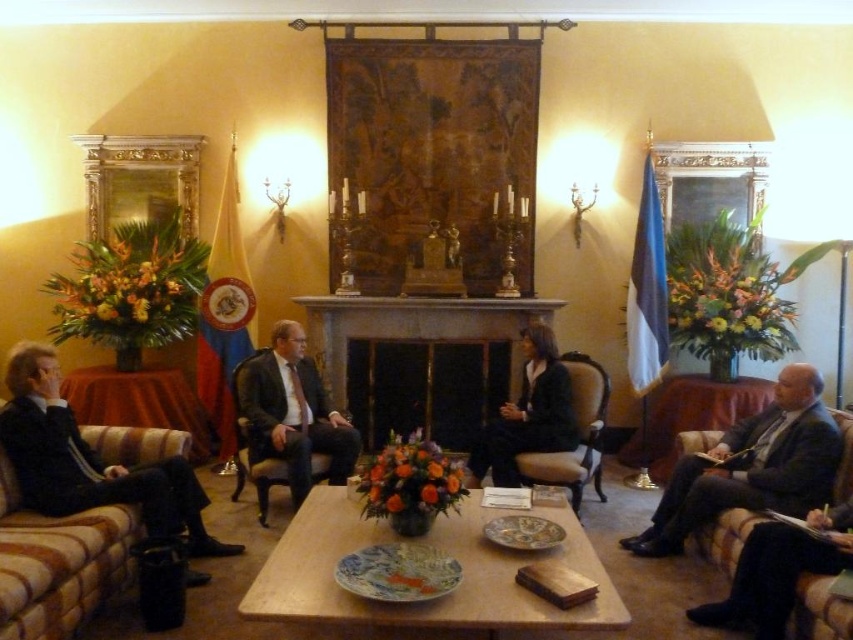
Based on the photo, you are a photographer positioned at the entrance of the room. You need to capture a photo that includes both the matte black suit at center and the brown leather couch at lower right. Considering their heights, which object should be placed closer to the camera to ensure both are fully visible in the frame?

The matte black suit at center is taller than the brown leather couch at lower right. To ensure both are fully visible, position the taller matte black suit at center closer to the camera so its full height can be captured without cropping, while the shorter couch can be placed further back and still remain in frame.